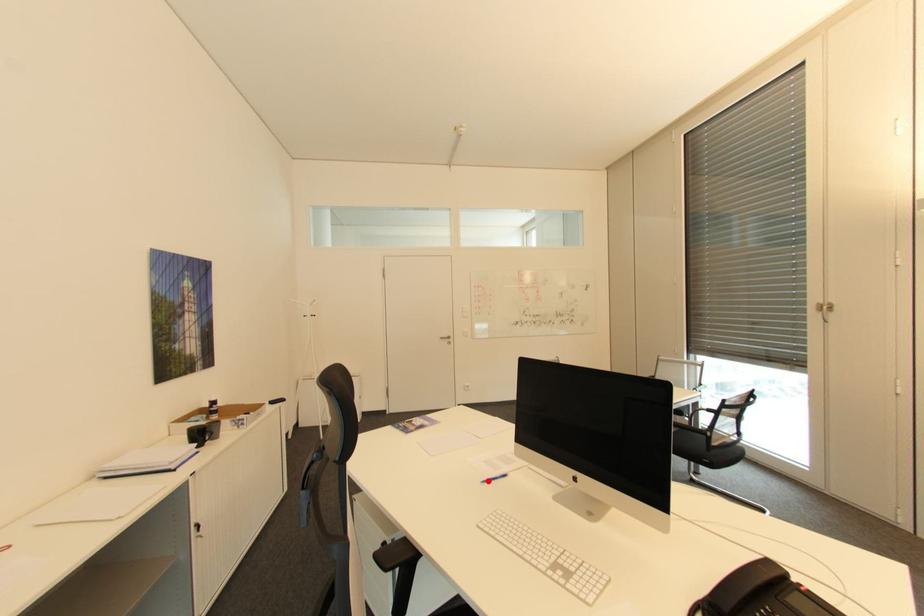
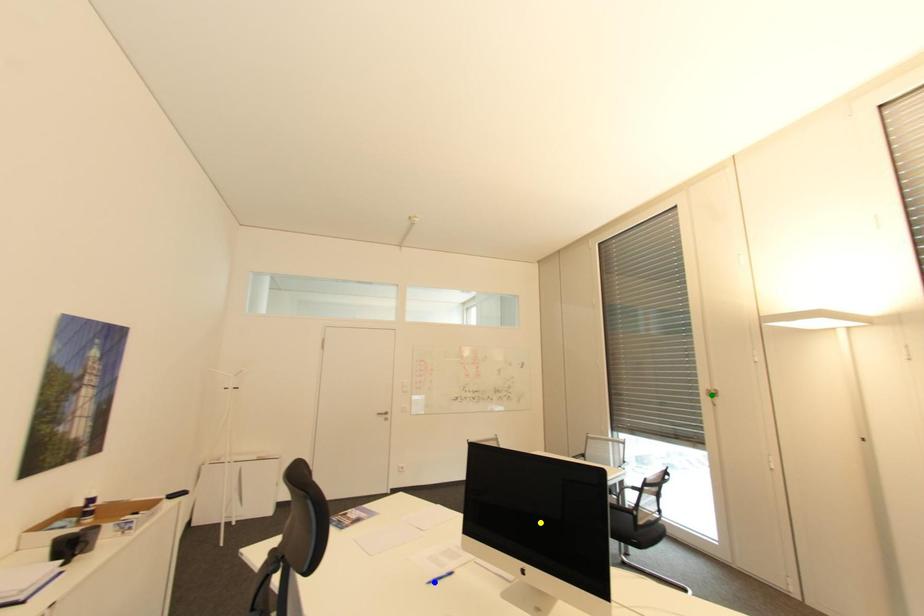
Question: I am providing you with two images of the same scene from different viewpoints. A red point is marked on the first image. You are given multiple points on the second image. Can you choose the point in image 2 that corresponds to the point in image 1?

Choices:
 (A) yellow point
 (B) blue point
 (C) green point

Answer: (B)